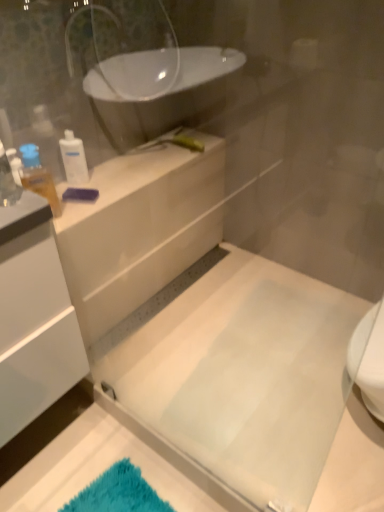
Question: From a real-world perspective, is translucent plastic bottle at upper left, which is counted as the second toiletry, starting from the back, physically located above or below white glossy counter at upper left?

Choices:
 (A) below
 (B) above

Answer: (B)

Question: Is translucent plastic bottle at upper left, which is counted as the second toiletry, starting from the back, wider or thinner than white glossy counter at upper left?

Choices:
 (A) thin
 (B) wide

Answer: (A)

Question: Estimate the real-world distances between objects in this image. Which object is farther from the translucent plastic bottle at upper left, which is counted as the 1th toiletry, starting from the front?

Choices:
 (A) white glossy counter at upper left
 (B) white plastic bottle at upper left, positioned as the 2th toiletry in front-to-back order

Answer: (A)

Question: Which of these objects is positioned closest to the white glossy counter at upper left?

Choices:
 (A) white plastic bottle at upper left, which is the 1th toiletry in back-to-front order
 (B) translucent plastic bottle at upper left, which is counted as the 1th toiletry, starting from the front

Answer: (A)